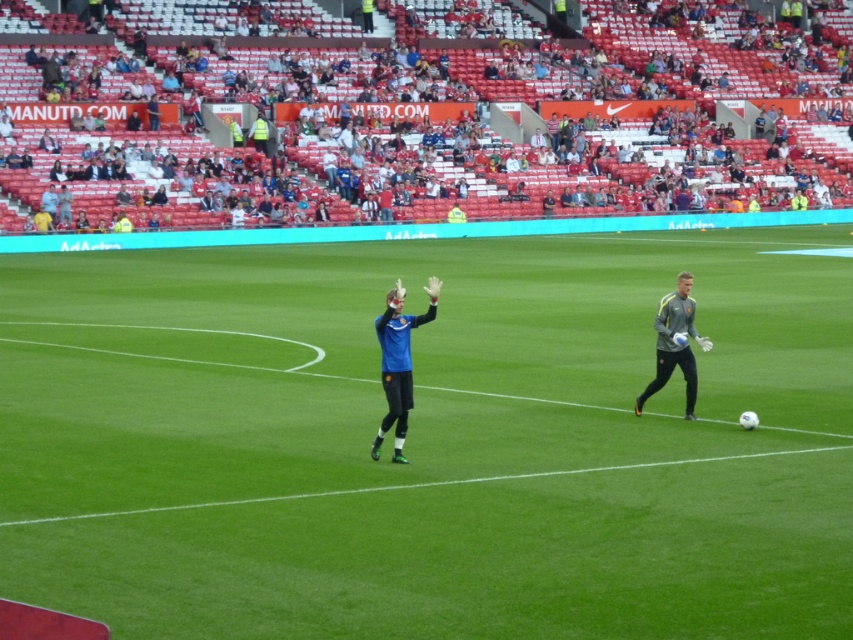
Is blue jersey at center in front of gray synthetic jacket at right?

No, blue jersey at center is further to the viewer.

Who is taller, blue jersey at center or gray synthetic jacket at right?

blue jersey at center is taller.

Measure the distance between blue jersey at center and camera.

38.19 meters

Where is `blue jersey at center`? The image size is (853, 640). blue jersey at center is located at coordinates (462, 122).

Is the position of blue jersey at center more distant than that of blue matte jersey at center?

Yes.

Does blue jersey at center have a smaller size compared to blue matte jersey at center?

Actually, blue jersey at center might be larger than blue matte jersey at center.

Does point (340, 204) come behind point (398, 392)?

Yes, it is behind point (398, 392).

Locate an element on the screen. This screenshot has height=640, width=853. blue jersey at center is located at coordinates (462, 122).

Who is positioned more to the right, green grass field at center or blue jersey at center?

blue jersey at center

Can you confirm if green grass field at center is wider than blue jersey at center?

In fact, green grass field at center might be narrower than blue jersey at center.

Between point (90, 602) and point (461, 67), which one is positioned in front?

Point (90, 602) is in front.

You are a GUI agent. You are given a task and a screenshot of the screen. Output one action in this format:
    pyautogui.click(x=<x>, y=<y>)
    Task: Click on the green grass field at center
    
    Given the screenshot: What is the action you would take?
    pyautogui.click(x=430, y=440)